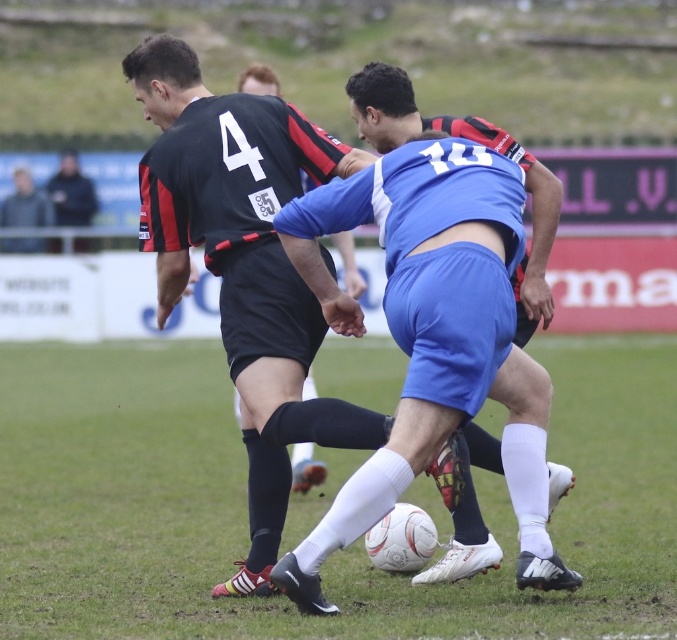
In the scene shown: You are a soccer coach analyzing the game from the sidelines. You notice the white textured football at center and the dark blue jacket at upper left. Which object is positioned further to the right in the image?

The white textured football at center is positioned further to the right compared to the dark blue jacket at upper left.

You are a soccer coach observing the match. You notice the white textured football at center and the dark blue jacket at upper left. Which object is closer to the front of the field?

The white textured football at center is closer to the front of the field because it is in front of the dark blue jacket at upper left.

You are a soccer coach analyzing the game footage. You notice the blue matte shorts at center and the dark blue jacket at upper left in the image. Which of these two items appears to be larger in size within the frame?

The dark blue jacket at upper left is larger than the blue matte shorts at center.